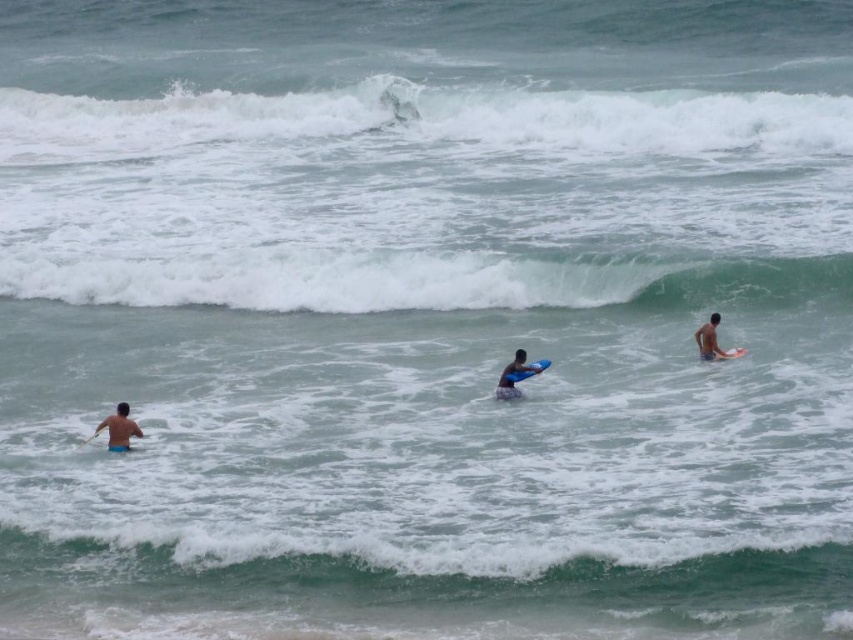
Does point (520, 108) lie in front of point (735, 356)?

No, (520, 108) is further to viewer.

Identify the location of white frothy wave at upper center. point(421,122).

Between blue matte surfboard at center and brown skin at upper right, which one has less height?

brown skin at upper right

Is the position of blue matte surfboard at center more distant than that of brown skin at upper right?

No, blue matte surfboard at center is closer to the viewer.

Where is `blue matte surfboard at center`? The width and height of the screenshot is (853, 640). blue matte surfboard at center is located at coordinates pos(514,372).

You are a GUI agent. You are given a task and a screenshot of the screen. Output one action in this format:
    pyautogui.click(x=<x>, y=<y>)
    Task: Click on the blue matte surfboard at center
    The image size is (853, 640).
    Given the screenshot: What is the action you would take?
    pyautogui.click(x=514, y=372)

Which of these two, skinny man at left or blue foam surfboard at right, stands shorter?

With less height is blue foam surfboard at right.

Is skinny man at left smaller than blue foam surfboard at right?

No.

Does point (123, 449) lie in front of point (723, 358)?

Yes, point (123, 449) is in front of point (723, 358).

Where is `skinny man at left`? Image resolution: width=853 pixels, height=640 pixels. skinny man at left is located at coordinates (119, 428).